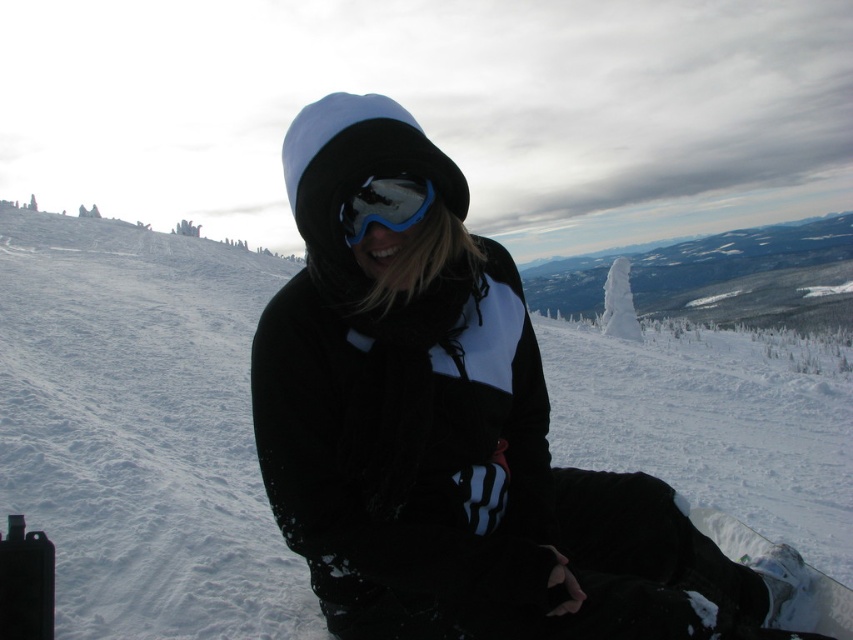
Describe the element at coordinates (141, 429) in the screenshot. I see `white fluffy snow at center` at that location.

Who is shorter, white fluffy snow at center or white glossy snowboard at lower right?

Standing shorter between the two is white glossy snowboard at lower right.

Image resolution: width=853 pixels, height=640 pixels. Find the location of `white fluffy snow at center`. white fluffy snow at center is located at coordinates (141, 429).

Is white fluffy snow at center further to the viewer compared to matte blue ski goggles at center?

Yes, white fluffy snow at center is behind matte blue ski goggles at center.

Which is in front, point (111, 348) or point (364, 212)?

Positioned in front is point (364, 212).

This screenshot has height=640, width=853. I want to click on white fluffy snow at center, so pyautogui.click(x=141, y=429).

Can you confirm if white glossy snowboard at lower right is wider than matte blue ski goggles at center?

Yes, white glossy snowboard at lower right is wider than matte blue ski goggles at center.

The height and width of the screenshot is (640, 853). What do you see at coordinates (817, 605) in the screenshot?
I see `white glossy snowboard at lower right` at bounding box center [817, 605].

Identify the location of white glossy snowboard at lower right. (817, 605).